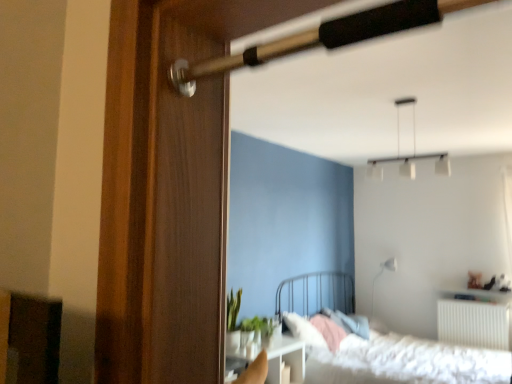
Question: Should I look upward or downward to see green matte plant at center?

Choices:
 (A) down
 (B) up

Answer: (A)

Question: Is wooden cabinet at lower left closer to the viewer compared to white plastic radiator at lower right?

Choices:
 (A) no
 (B) yes

Answer: (B)

Question: Is wooden cabinet at lower left wider than white plastic radiator at lower right?

Choices:
 (A) no
 (B) yes

Answer: (A)

Question: Does wooden cabinet at lower left appear on the right side of white plastic radiator at lower right?

Choices:
 (A) yes
 (B) no

Answer: (B)

Question: From the image's perspective, is wooden cabinet at lower left above white plastic radiator at lower right?

Choices:
 (A) yes
 (B) no

Answer: (A)

Question: Is wooden cabinet at lower left facing away from white plastic radiator at lower right?

Choices:
 (A) no
 (B) yes

Answer: (A)

Question: Is wooden cabinet at lower left located outside white plastic radiator at lower right?

Choices:
 (A) no
 (B) yes

Answer: (B)

Question: From a real-world perspective, is white glossy lamp at upper right, the 1th lamp positioned from the back, beneath wooden door handle at upper center?

Choices:
 (A) no
 (B) yes

Answer: (B)

Question: Is white glossy lamp at upper right, the 1th lamp in the right-to-left sequence, next to wooden door handle at upper center and touching it?

Choices:
 (A) yes
 (B) no

Answer: (B)

Question: Can you confirm if white glossy lamp at upper right, marked as the 1th lamp in a bottom-to-top arrangement, is wider than wooden door handle at upper center?

Choices:
 (A) yes
 (B) no

Answer: (A)

Question: Is white glossy lamp at upper right, marked as the second lamp in a front-to-back arrangement, turned away from wooden door handle at upper center?

Choices:
 (A) yes
 (B) no

Answer: (B)

Question: Does white glossy lamp at upper right, the second lamp when ordered from left to right, come in front of wooden door handle at upper center?

Choices:
 (A) no
 (B) yes

Answer: (A)

Question: Can you confirm if white glossy lamp at upper right, the second lamp when ordered from left to right, is thinner than wooden door handle at upper center?

Choices:
 (A) yes
 (B) no

Answer: (B)

Question: Is green matte plant at center completely or partially outside of white glossy lamp at upper right, which ranks as the 2th lamp in top-to-bottom order?

Choices:
 (A) no
 (B) yes

Answer: (B)